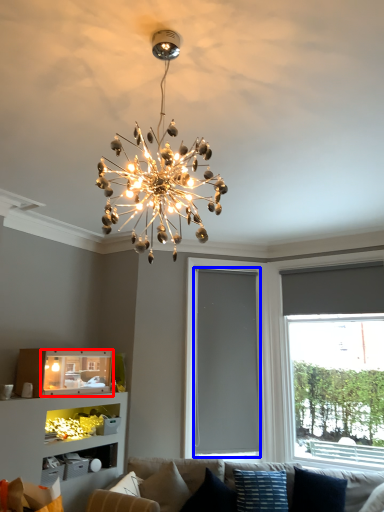
Question: Which point is closer to the camera, shelf (highlighted by a red box) or window screen (highlighted by a blue box)?

Choices:
 (A) shelf
 (B) window screen

Answer: (A)